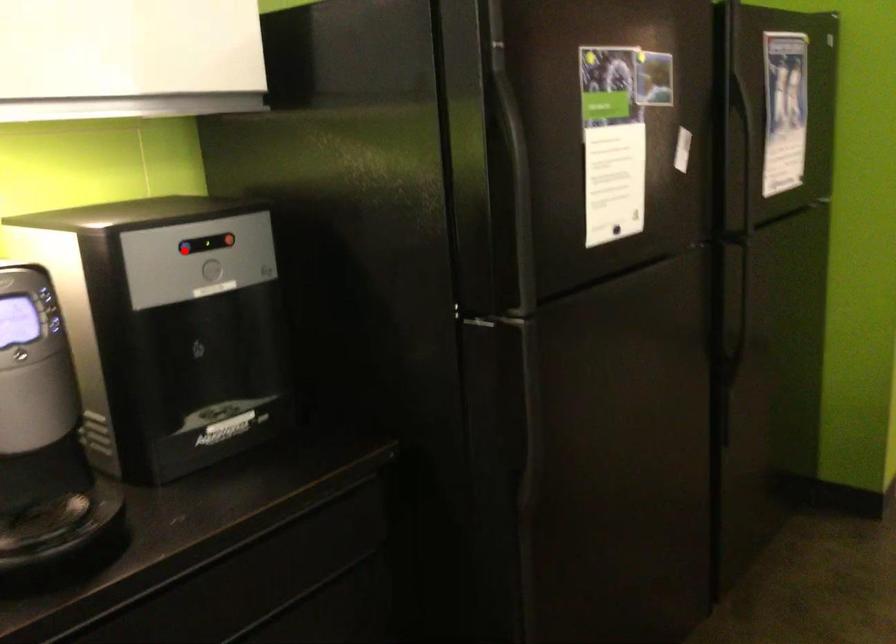
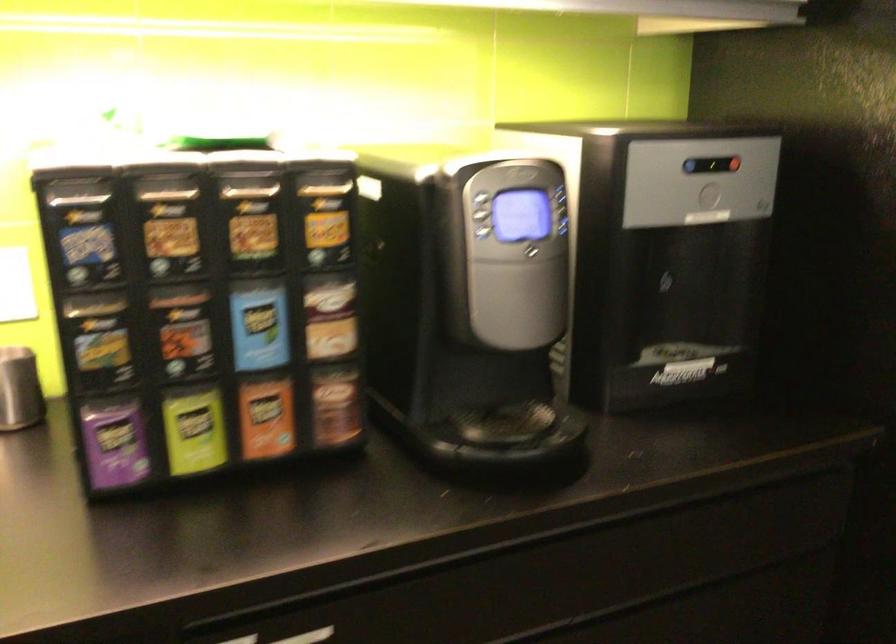
Question: I am providing you with two images of the same scene from different viewpoints. A red point is marked on the first image. At the location where the point appears in image 1, is it still visible in image 2?

Choices:
 (A) Yes
 (B) No

Answer: (A)